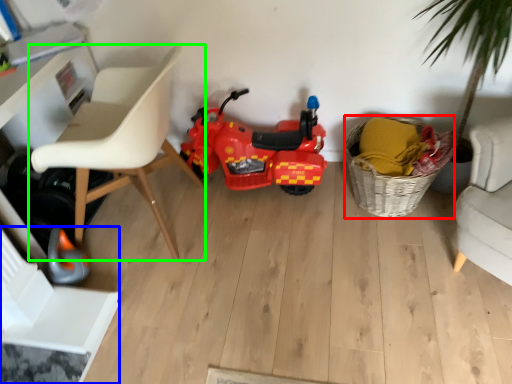
Question: Which is farther away from basket (highlighted by a red box)? swivel chair (highlighted by a blue box) or chair (highlighted by a green box)?

Choices:
 (A) swivel chair
 (B) chair

Answer: (A)